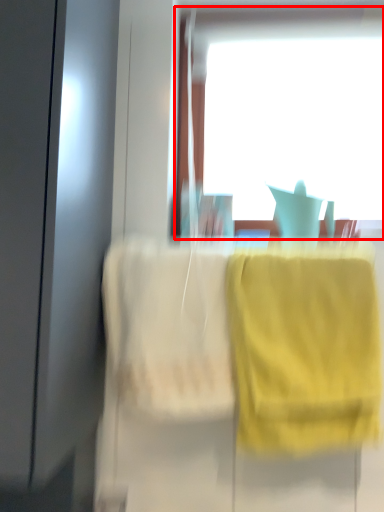
Question: Considering the relative positions of window (annotated by the red box) and towel/napkin in the image provided, where is window (annotated by the red box) located with respect to the staircase?

Choices:
 (A) left
 (B) right

Answer: (B)